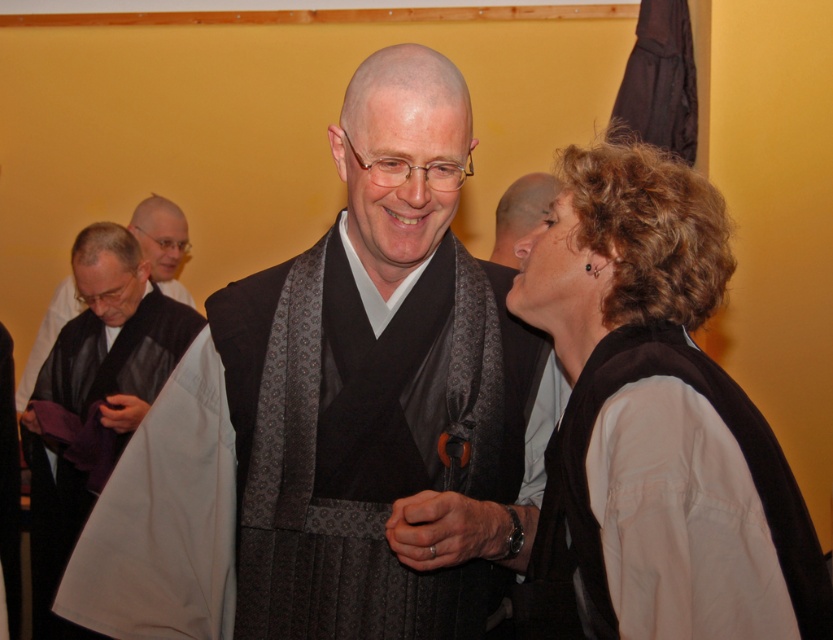
You are an observer standing in front of the group. Which object is positioned to the left of the other between the matte brown vest at right and the gray matte head at upper center?

The matte brown vest at right is to the left of the gray matte head at upper center according to the description.

What is the object located at the coordinate point (380,390) in the image?

The object at coordinate point (380,390) is the black silk kimono at center.

You are organizing a cultural exhibition and need to display the black silk kimono at center and the matte brown vest at right. Since space is limited, you must determine which item requires more space. Based on the image, which one needs more space?

The black silk kimono at center requires more space because it is larger in size than the matte brown vest at right.